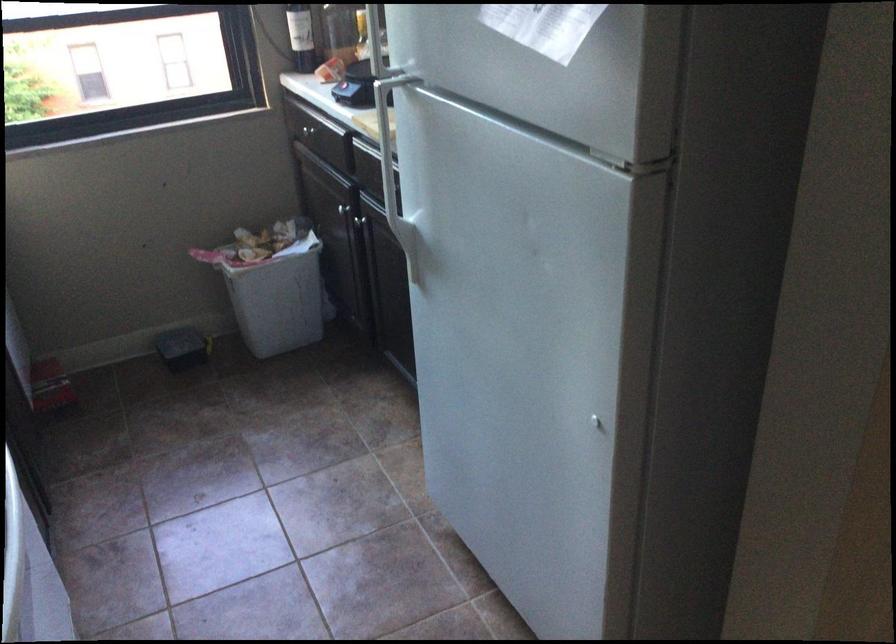
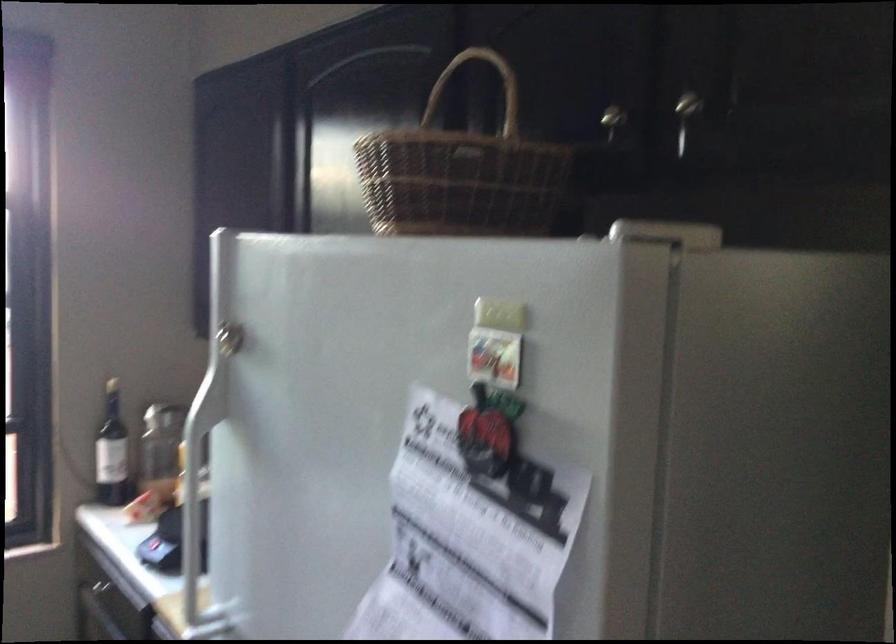
Question: In a continuous first-person perspective shot, in which direction is the camera moving?

Choices:
 (A) Left
 (B) Right
 (C) Forward
 (D) Backward

Answer: (C)